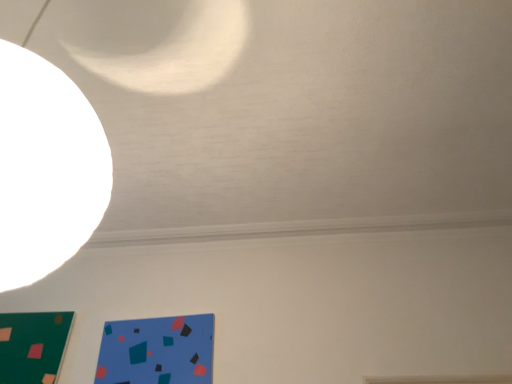
In order to face green matte board at lower left, should I rotate leftwards or rightwards?

Turn left approximately 28.399 degrees to face it.

The width and height of the screenshot is (512, 384). Describe the element at coordinates (32, 346) in the screenshot. I see `green matte board at lower left` at that location.

What are the coordinates of `green matte board at lower left` in the screenshot? It's located at (32, 346).

What do you see at coordinates (157, 350) in the screenshot? I see `blue matte paper at lower left` at bounding box center [157, 350].

The height and width of the screenshot is (384, 512). What are the coordinates of `blue matte paper at lower left` in the screenshot? It's located at (157, 350).

In order to face blue matte paper at lower left, should I rotate leftwards or rightwards?

Rotate left and turn 12.980 degrees.

The height and width of the screenshot is (384, 512). I want to click on green matte board at lower left, so click(x=32, y=346).

Which object is positioned more to the right, green matte board at lower left or blue matte paper at lower left?

blue matte paper at lower left is more to the right.

Which is behind, green matte board at lower left or blue matte paper at lower left?

Positioned behind is green matte board at lower left.

Which is closer to the camera, (24, 357) or (210, 370)?

The point (210, 370) is closer to the camera.

From the image's perspective, who appears lower, green matte board at lower left or blue matte paper at lower left?

green matte board at lower left.

From a real-world perspective, is green matte board at lower left on blue matte paper at lower left?

Yes.

Between green matte board at lower left and blue matte paper at lower left, which one has smaller width?

blue matte paper at lower left is thinner.

Is green matte board at lower left taller or shorter than blue matte paper at lower left?

Considering their sizes, green matte board at lower left has more height than blue matte paper at lower left.

Between green matte board at lower left and blue matte paper at lower left, which one has smaller size?

green matte board at lower left.

Is blue matte paper at lower left completely or partially inside green matte board at lower left?

Actually, blue matte paper at lower left is outside green matte board at lower left.

Is green matte board at lower left touching blue matte paper at lower left?

They are not placed beside each other.

Is blue matte paper at lower left at the back of green matte board at lower left?

green matte board at lower left does not have its back to blue matte paper at lower left.

Can you tell me how much green matte board at lower left and blue matte paper at lower left differ in facing direction?

0.729 degrees.

This screenshot has width=512, height=384. I want to click on design on the right of green matte board at lower left, so click(x=157, y=350).

Does blue matte paper at lower left appear on the right side of green matte board at lower left?

Correct, you'll find blue matte paper at lower left to the right of green matte board at lower left.

Who is more distant, blue matte paper at lower left or green matte board at lower left?

green matte board at lower left is further away from the camera.

Considering the points (172, 371) and (4, 318), which point is in front, point (172, 371) or point (4, 318)?

Positioned in front is point (172, 371).

From the image's perspective, is blue matte paper at lower left above or below green matte board at lower left?

From the image's perspective, blue matte paper at lower left appears above green matte board at lower left.

From a real-world perspective, between blue matte paper at lower left and green matte board at lower left, who is vertically lower?

From a 3D spatial view, blue matte paper at lower left is below.

Considering the sizes of objects blue matte paper at lower left and green matte board at lower left in the image provided, who is wider, blue matte paper at lower left or green matte board at lower left?

Wider between the two is green matte board at lower left.

From their relative heights in the image, would you say blue matte paper at lower left is taller or shorter than green matte board at lower left?

Clearly, blue matte paper at lower left is shorter compared to green matte board at lower left.

From the picture: Based on their sizes in the image, would you say blue matte paper at lower left is bigger or smaller than green matte board at lower left?

In the image, blue matte paper at lower left appears to be larger than green matte board at lower left.

Based on the photo, does blue matte paper at lower left contain green matte board at lower left?

Actually, green matte board at lower left is outside blue matte paper at lower left.

Can you see blue matte paper at lower left touching green matte board at lower left?

blue matte paper at lower left and green matte board at lower left are clearly separated.

Looking at this image, is blue matte paper at lower left positioned with its back to green matte board at lower left?

No, blue matte paper at lower left's orientation is not away from green matte board at lower left.

How different are the orientations of blue matte paper at lower left and green matte board at lower left in degrees?

The angular difference between blue matte paper at lower left and green matte board at lower left is 0.729 degrees.

Find the location of a particular element. This screenshot has height=384, width=512. design on the right of green matte board at lower left is located at coordinates (157, 350).

The image size is (512, 384). Identify the location of design located on the right of green matte board at lower left. (157, 350).

The image size is (512, 384). I want to click on rectangle that appears on the left of blue matte paper at lower left, so click(x=32, y=346).